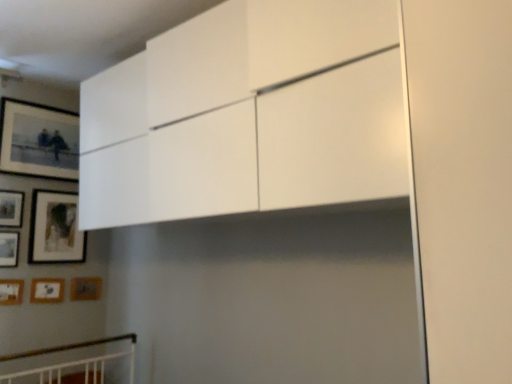
Measure the distance between matte black picture frame at upper left, acting as the 3th picture frame starting from the top, and camera.

matte black picture frame at upper left, acting as the 3th picture frame starting from the top, is 8.05 feet from camera.

Image resolution: width=512 pixels, height=384 pixels. What do you see at coordinates (85, 288) in the screenshot?
I see `wooden matte picture frame at lower left, placed as the 7th picture frame when sorted from top to bottom` at bounding box center [85, 288].

What is the approximate width of wooden picture frame at lower left, which is the third picture frame from bottom to top?

0.78 inches.

Where is `matte black picture frame at upper left, positioned as the 1th picture frame in top-to-bottom order`? The image size is (512, 384). matte black picture frame at upper left, positioned as the 1th picture frame in top-to-bottom order is located at coordinates (38, 140).

You are a GUI agent. You are given a task and a screenshot of the screen. Output one action in this format:
    pyautogui.click(x=<x>, y=<y>)
    Task: Click on the wooden matte picture frame at lower left, which appears as the 4th picture frame when viewed from the top
    The image size is (512, 384).
    Given the screenshot: What is the action you would take?
    pyautogui.click(x=9, y=248)

Which is less distant, (78, 281) or (4, 292)?

The point (4, 292) is closer.

Is wooden matte picture frame at lower left, placed as the 7th picture frame when sorted from top to bottom, in front of or behind wooden picture frame at lower left, which ranks as the fifth picture frame in top-to-bottom order, in the image?

Visually, wooden matte picture frame at lower left, placed as the 7th picture frame when sorted from top to bottom, is located behind wooden picture frame at lower left, which ranks as the fifth picture frame in top-to-bottom order.

Is wooden matte picture frame at lower left, marked as the 1th picture frame in a bottom-to-top arrangement, taller than wooden picture frame at lower left, which is the third picture frame from bottom to top?

In fact, wooden matte picture frame at lower left, marked as the 1th picture frame in a bottom-to-top arrangement, may be shorter than wooden picture frame at lower left, which is the third picture frame from bottom to top.

Based on their positions, is wooden matte picture frame at left, the sixth picture frame ordered from the bottom, located to the left or right of matte black picture frame at upper left, the 5th picture frame positioned from the bottom?

wooden matte picture frame at left, the sixth picture frame ordered from the bottom, is to the left of matte black picture frame at upper left, the 5th picture frame positioned from the bottom.

Does point (11, 224) appear closer or farther from the camera than point (68, 210)?

Point (11, 224).

Considering the sizes of objects wooden matte picture frame at left, which appears as the 2th picture frame when viewed from the top, and matte black picture frame at upper left, the 5th picture frame positioned from the bottom, in the image provided, who is taller, wooden matte picture frame at left, which appears as the 2th picture frame when viewed from the top, or matte black picture frame at upper left, the 5th picture frame positioned from the bottom,?

matte black picture frame at upper left, the 5th picture frame positioned from the bottom.

Are wooden matte picture frame at left, which appears as the 2th picture frame when viewed from the top, and matte black picture frame at upper left, the 5th picture frame positioned from the bottom, beside each other?

No, wooden matte picture frame at left, which appears as the 2th picture frame when viewed from the top, is not with matte black picture frame at upper left, the 5th picture frame positioned from the bottom.

Consider the image. Is wooden matte picture frame at left, which appears as the 2th picture frame when viewed from the top, positioned beyond the bounds of wooden picture frame at lower left, which is the third picture frame from bottom to top?

wooden matte picture frame at left, which appears as the 2th picture frame when viewed from the top, lies outside wooden picture frame at lower left, which is the third picture frame from bottom to top,'s area.

Can you see wooden matte picture frame at left, which appears as the 2th picture frame when viewed from the top, touching wooden picture frame at lower left, which ranks as the fifth picture frame in top-to-bottom order?

No, wooden matte picture frame at left, which appears as the 2th picture frame when viewed from the top, is not next to wooden picture frame at lower left, which ranks as the fifth picture frame in top-to-bottom order.

Which of these two, wooden matte picture frame at left, the sixth picture frame ordered from the bottom, or wooden picture frame at lower left, which ranks as the fifth picture frame in top-to-bottom order, stands shorter?

Standing shorter between the two is wooden picture frame at lower left, which ranks as the fifth picture frame in top-to-bottom order.

From a real-world perspective, is wooden matte picture frame at left, the sixth picture frame ordered from the bottom, over wooden picture frame at lower left, which ranks as the fifth picture frame in top-to-bottom order?

Indeed, from a real-world perspective, wooden matte picture frame at left, the sixth picture frame ordered from the bottom, stands above wooden picture frame at lower left, which ranks as the fifth picture frame in top-to-bottom order.

From a real-world perspective, does matte black picture frame at upper left, the 5th picture frame positioned from the bottom, stand above wooden picture frame at lower left, which ranks as the fifth picture frame in top-to-bottom order?

Yes, from a real-world perspective, matte black picture frame at upper left, the 5th picture frame positioned from the bottom, is on top of wooden picture frame at lower left, which ranks as the fifth picture frame in top-to-bottom order.

Does matte black picture frame at upper left, acting as the 3th picture frame starting from the top, appear on the right side of wooden picture frame at lower left, which is the third picture frame from bottom to top?

Yes, matte black picture frame at upper left, acting as the 3th picture frame starting from the top, is to the right of wooden picture frame at lower left, which is the third picture frame from bottom to top.

Which is correct: matte black picture frame at upper left, the 5th picture frame positioned from the bottom, is inside wooden picture frame at lower left, which is the third picture frame from bottom to top, or outside of it?

matte black picture frame at upper left, the 5th picture frame positioned from the bottom, is not inside wooden picture frame at lower left, which is the third picture frame from bottom to top, it's outside.

Considering the sizes of objects matte black picture frame at upper left, acting as the 3th picture frame starting from the top, and wooden picture frame at lower left, which ranks as the fifth picture frame in top-to-bottom order, in the image provided, who is thinner, matte black picture frame at upper left, acting as the 3th picture frame starting from the top, or wooden picture frame at lower left, which ranks as the fifth picture frame in top-to-bottom order,?

Thinner between the two is wooden picture frame at lower left, which ranks as the fifth picture frame in top-to-bottom order.

Does wooden matte picture frame at lower left, which appears as the 4th picture frame when ordered from the bottom, have a smaller size compared to matte black picture frame at upper left, the 5th picture frame positioned from the bottom?

Yes, wooden matte picture frame at lower left, which appears as the 4th picture frame when ordered from the bottom, is smaller than matte black picture frame at upper left, the 5th picture frame positioned from the bottom.

From the image's perspective, would you say wooden matte picture frame at lower left, which appears as the 4th picture frame when viewed from the top, is positioned over matte black picture frame at upper left, the 5th picture frame positioned from the bottom?

Incorrect, from the image's perspective, wooden matte picture frame at lower left, which appears as the 4th picture frame when viewed from the top, is lower than matte black picture frame at upper left, the 5th picture frame positioned from the bottom.

Based on the photo, is wooden matte picture frame at lower left, which appears as the 4th picture frame when viewed from the top, not near matte black picture frame at upper left, the 5th picture frame positioned from the bottom?

wooden matte picture frame at lower left, which appears as the 4th picture frame when viewed from the top, is actually quite close to matte black picture frame at upper left, the 5th picture frame positioned from the bottom.

From the image's perspective, is wooden matte picture frame at lower left, which appears as the 2th picture frame when ordered from the bottom, below wooden matte picture frame at left, which appears as the 2th picture frame when viewed from the top?

Correct, wooden matte picture frame at lower left, which appears as the 2th picture frame when ordered from the bottom, appears lower than wooden matte picture frame at left, which appears as the 2th picture frame when viewed from the top, in the image.

Could you tell me if wooden matte picture frame at lower left, which is the sixth picture frame in top-to-bottom order, is turned towards wooden matte picture frame at left, which appears as the 2th picture frame when viewed from the top?

No.

Are wooden matte picture frame at lower left, which appears as the 2th picture frame when ordered from the bottom, and wooden matte picture frame at left, the sixth picture frame ordered from the bottom, making contact?

No, wooden matte picture frame at lower left, which appears as the 2th picture frame when ordered from the bottom, is not beside wooden matte picture frame at left, the sixth picture frame ordered from the bottom.

Can you confirm if wooden matte picture frame at lower left, which appears as the 2th picture frame when ordered from the bottom, is shorter than wooden matte picture frame at left, the sixth picture frame ordered from the bottom?

Correct, wooden matte picture frame at lower left, which appears as the 2th picture frame when ordered from the bottom, is not as tall as wooden matte picture frame at left, the sixth picture frame ordered from the bottom.

Can you tell me how much wooden matte picture frame at lower left, which appears as the 4th picture frame when viewed from the top, and matte black picture frame at upper left, positioned as the 1th picture frame in top-to-bottom order, differ in facing direction?

They differ by 0.293 degrees in their facing directions.

Find the location of a particular element. The height and width of the screenshot is (384, 512). the 3rd picture frame counting from the right of the wooden matte picture frame at lower left, which appears as the 4th picture frame when viewed from the top is located at coordinates (38, 140).

Is wooden matte picture frame at lower left, which appears as the 4th picture frame when viewed from the top, positioned far away from matte black picture frame at upper left, positioned as the 7th picture frame in bottom-to-top order?

wooden matte picture frame at lower left, which appears as the 4th picture frame when viewed from the top, is near matte black picture frame at upper left, positioned as the 7th picture frame in bottom-to-top order, not far away.

From the image's perspective, does wooden matte picture frame at lower left, which appears as the 4th picture frame when ordered from the bottom, appear lower than matte black picture frame at upper left, positioned as the 1th picture frame in top-to-bottom order?

Yes.

There is a wooden picture frame at lower left, which is the third picture frame from bottom to top. Where is `the 2nd picture frame below it (from a real-world perspective)`? the 2nd picture frame below it (from a real-world perspective) is located at coordinates (85, 288).

In order to click on the 4th picture frame to the right of the wooden matte picture frame at left, the sixth picture frame ordered from the bottom, starting your count from the anchor in this screenshot , I will do `click(55, 229)`.

Based on the photo, which object lies nearer to the anchor point wooden picture frame at lower left, which ranks as the fifth picture frame in top-to-bottom order, wooden matte picture frame at lower left, marked as the 1th picture frame in a bottom-to-top arrangement, or wooden matte picture frame at left, the sixth picture frame ordered from the bottom?

wooden matte picture frame at lower left, marked as the 1th picture frame in a bottom-to-top arrangement, lies closer to wooden picture frame at lower left, which ranks as the fifth picture frame in top-to-bottom order, than the other object.

When comparing their distances from wooden matte picture frame at lower left, which appears as the 4th picture frame when ordered from the bottom, does matte black picture frame at upper left, the 5th picture frame positioned from the bottom, or wooden picture frame at lower left, which is the third picture frame from bottom to top, seem closer?

wooden picture frame at lower left, which is the third picture frame from bottom to top.

Looking at the image, which one is located further to wooden matte picture frame at lower left, which appears as the 2th picture frame when ordered from the bottom, matte black picture frame at upper left, the 5th picture frame positioned from the bottom, or wooden picture frame at lower left, which ranks as the fifth picture frame in top-to-bottom order?

matte black picture frame at upper left, the 5th picture frame positioned from the bottom, is further to wooden matte picture frame at lower left, which appears as the 2th picture frame when ordered from the bottom.

Based on their spatial positions, is wooden matte picture frame at lower left, which appears as the 2th picture frame when ordered from the bottom, or wooden matte picture frame at left, which appears as the 2th picture frame when viewed from the top, closer to wooden picture frame at lower left, which is the third picture frame from bottom to top?

The object closer to wooden picture frame at lower left, which is the third picture frame from bottom to top, is wooden matte picture frame at lower left, which appears as the 2th picture frame when ordered from the bottom.

Estimate the real-world distances between objects in this image. Which object is closer to wooden picture frame at lower left, which is the third picture frame from bottom to top, wooden matte picture frame at lower left, which appears as the 4th picture frame when ordered from the bottom, or wooden matte picture frame at left, the sixth picture frame ordered from the bottom?

wooden matte picture frame at lower left, which appears as the 4th picture frame when ordered from the bottom.

From the image, which object appears to be nearer to matte black picture frame at upper left, the 5th picture frame positioned from the bottom, matte black picture frame at upper left, positioned as the 7th picture frame in bottom-to-top order, or wooden matte picture frame at left, the sixth picture frame ordered from the bottom?

The object closer to matte black picture frame at upper left, the 5th picture frame positioned from the bottom, is wooden matte picture frame at left, the sixth picture frame ordered from the bottom.

Considering their positions, is wooden matte picture frame at lower left, which appears as the 4th picture frame when viewed from the top, positioned closer to wooden matte picture frame at left, the sixth picture frame ordered from the bottom, than matte black picture frame at upper left, the 5th picture frame positioned from the bottom?

wooden matte picture frame at lower left, which appears as the 4th picture frame when viewed from the top, is positioned closer to the anchor wooden matte picture frame at left, the sixth picture frame ordered from the bottom.

Estimate the real-world distances between objects in this image. Which object is closer to matte black picture frame at upper left, acting as the 3th picture frame starting from the top, matte black picture frame at upper left, positioned as the 7th picture frame in bottom-to-top order, or wooden picture frame at lower left, which is the third picture frame from bottom to top?

The object closer to matte black picture frame at upper left, acting as the 3th picture frame starting from the top, is matte black picture frame at upper left, positioned as the 7th picture frame in bottom-to-top order.

This screenshot has width=512, height=384. I want to click on picture frame between wooden matte picture frame at lower left, which appears as the 4th picture frame when viewed from the top, and wooden matte picture frame at lower left, which is the sixth picture frame in top-to-bottom order, in the up-down direction, so click(11, 291).

I want to click on picture frame between matte black picture frame at upper left, acting as the 3th picture frame starting from the top, and wooden picture frame at lower left, which is the third picture frame from bottom to top, from top to bottom, so click(x=9, y=248).

I want to click on picture frame between matte black picture frame at upper left, positioned as the 1th picture frame in top-to-bottom order, and matte black picture frame at upper left, acting as the 3th picture frame starting from the top, vertically, so click(x=11, y=208).